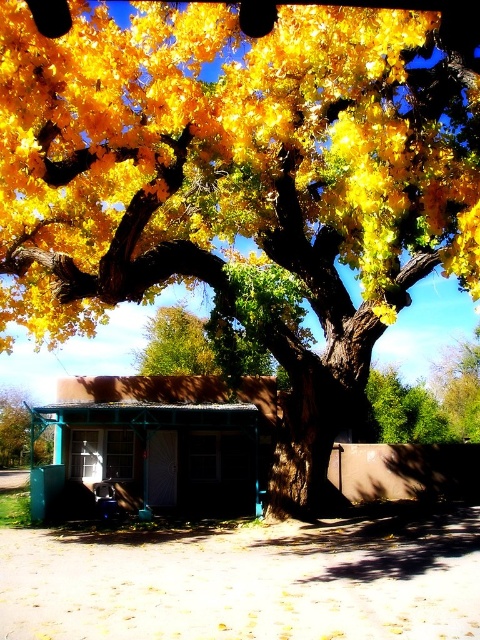
Question: Among these points, which one is nearest to the camera?

Choices:
 (A) (187, 349)
 (B) (0, 403)

Answer: (A)

Question: Does green painted wood hut at center have a larger size compared to green metallic pole at lower left?

Choices:
 (A) no
 (B) yes

Answer: (A)

Question: Which point is closer to the camera taking this photo?

Choices:
 (A) (160, 326)
 (B) (222, 384)

Answer: (B)

Question: Does green painted wood hut at center come in front of yellow leafy tree at center?

Choices:
 (A) no
 (B) yes

Answer: (B)

Question: Can you confirm if yellow leafy tree at center is positioned to the right of green metallic pole at lower left?

Choices:
 (A) yes
 (B) no

Answer: (A)

Question: Which point appears farthest from the camera in this image?

Choices:
 (A) (21, 397)
 (B) (75, 486)

Answer: (A)